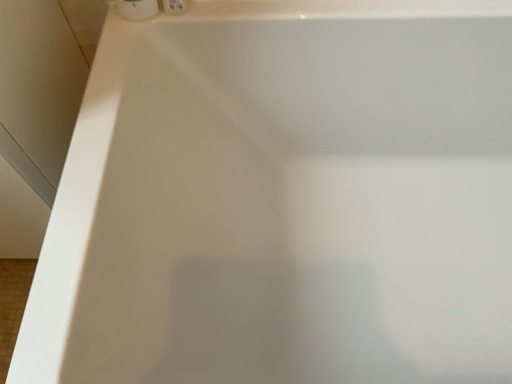
This screenshot has width=512, height=384. Describe the element at coordinates (137, 9) in the screenshot. I see `white matte toilet paper at upper left` at that location.

The width and height of the screenshot is (512, 384). Identify the location of white matte toilet paper at upper left. (137, 9).

Where is `white matte toilet paper at upper left`? Image resolution: width=512 pixels, height=384 pixels. white matte toilet paper at upper left is located at coordinates pos(137,9).